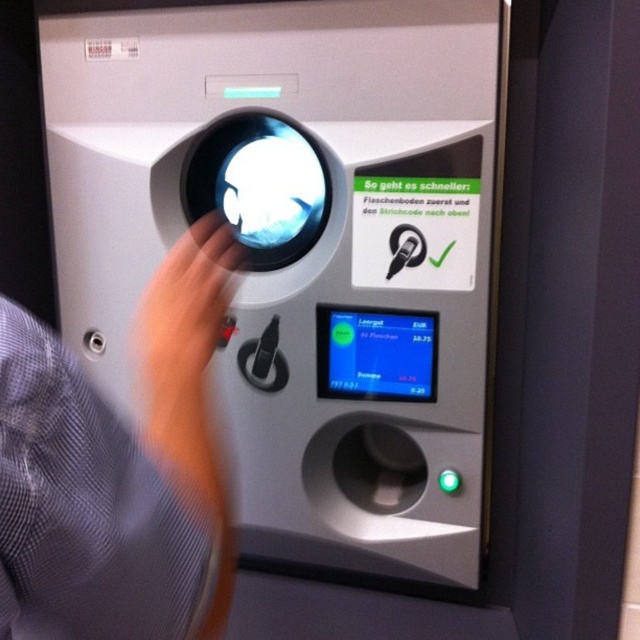
You are standing in front of the recycling machine and want to know how far the point at coordinates (486, 179) is from you. Can you determine the distance?

The point at coordinates (486, 179) is 32.34 inches away from the camera, so the distance from you to that point would be approximately 32.34 inches.

Where is the skinny fabric hand at center located in the image?

The skinny fabric hand at center is located at point 0.736 on the x axis and 0.186 on the y axis.